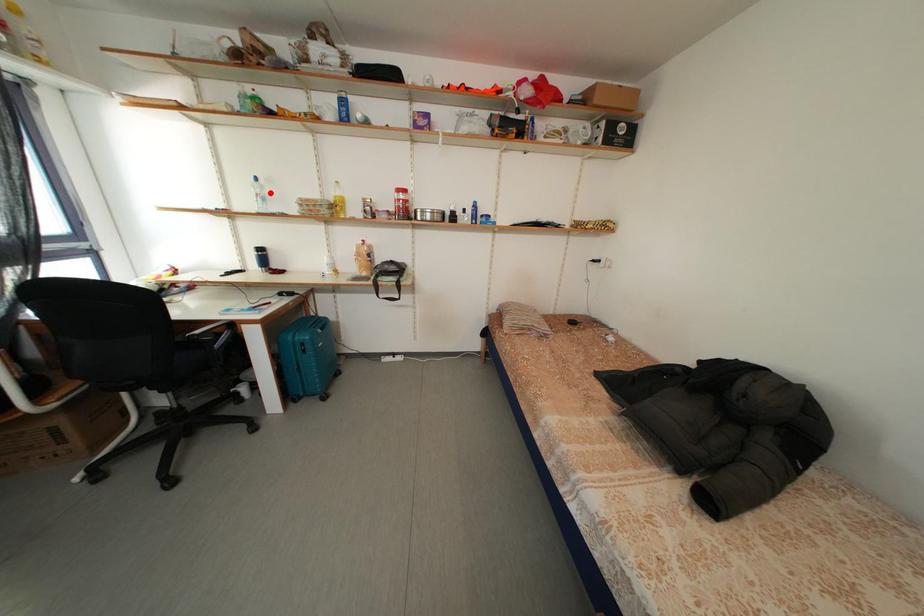
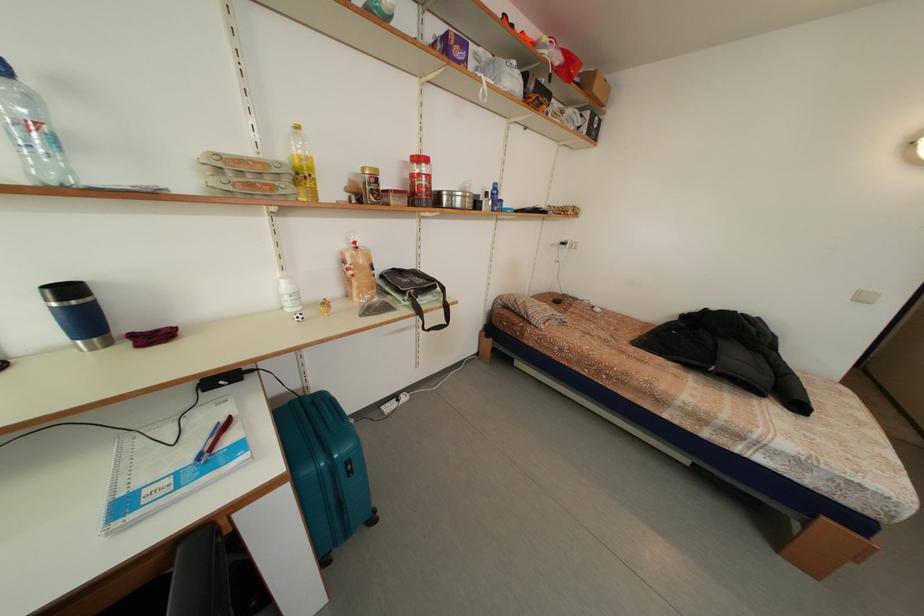
The point at the highlighted location is marked in the first image. Where is the corresponding point in the second image?

(40, 106)